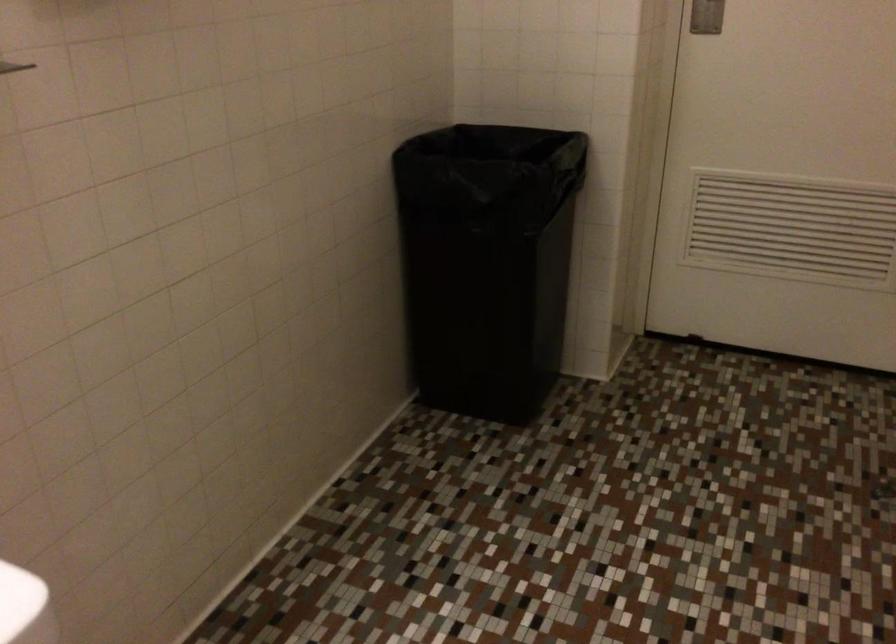
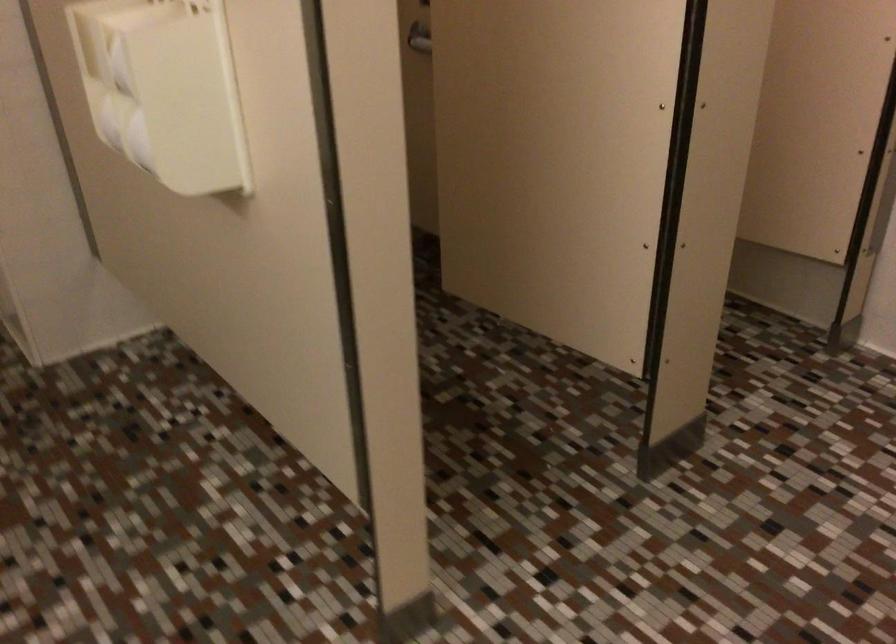
Looking at this image, the first image is from the beginning of the video and the second image is from the end. How did the camera likely rotate when shooting the video?

The camera rotated toward right-down.